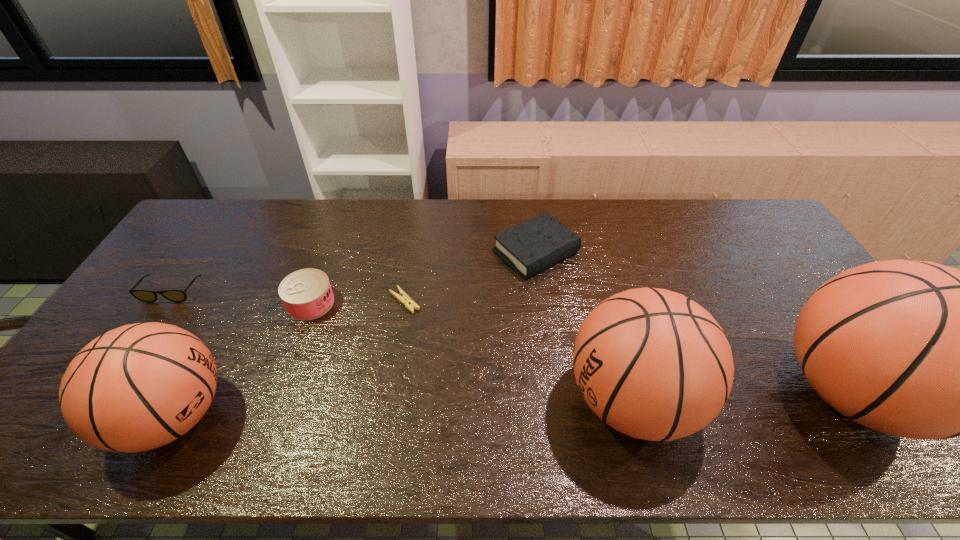
Identify the location of free space located on the surface of the third tallest object near the brand logo. The height and width of the screenshot is (540, 960). point(395,416).

Image resolution: width=960 pixels, height=540 pixels. I want to click on vacant space situated 0.250m on the surface of the second basketball from right to left near the brand logo, so click(x=463, y=400).

Locate an element on the screen. Image resolution: width=960 pixels, height=540 pixels. vacant space located on the surface of the second basketball from right to left near the brand logo is located at coordinates (528, 400).

Identify the location of free space located on the surface of the second basketball from right to left near the brand logo. This screenshot has width=960, height=540. (410, 400).

You are a GUI agent. You are given a task and a screenshot of the screen. Output one action in this format:
    pyautogui.click(x=<x>, y=<y>)
    Task: Click on the vacant position located 0.130m on the left of the Bible
    The image size is (960, 540).
    Given the screenshot: What is the action you would take?
    pyautogui.click(x=453, y=252)

I want to click on vacant region located 0.080m on the left of the can, so click(x=260, y=303).

Image resolution: width=960 pixels, height=540 pixels. What are the coordinates of `vacant area located 0.390m on the back of the clothespin` in the screenshot? It's located at (420, 212).

Identify the location of free space located 0.200m on the front-facing side of the sunglasses. (126, 359).

Where is `object located in the far edge section of the desktop`? The height and width of the screenshot is (540, 960). object located in the far edge section of the desktop is located at coordinates (534, 245).

Locate an element on the screen. Image resolution: width=960 pixels, height=540 pixels. basketball situated at the left edge is located at coordinates (138, 387).